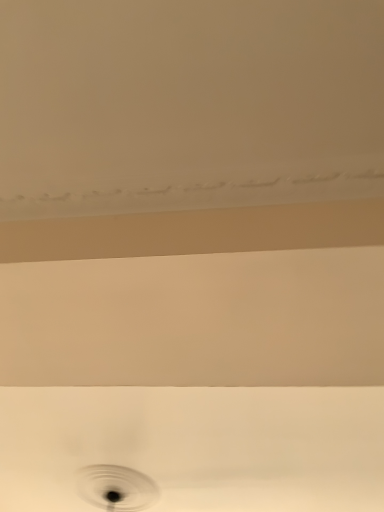
Image resolution: width=384 pixels, height=512 pixels. What do you see at coordinates (197, 446) in the screenshot?
I see `white glossy sink at center` at bounding box center [197, 446].

Locate an element on the screen. The height and width of the screenshot is (512, 384). white glossy sink at center is located at coordinates pyautogui.click(x=197, y=446).

This screenshot has width=384, height=512. I want to click on black matte hole at center, so click(116, 488).

Describe the element at coordinates (116, 488) in the screenshot. I see `black matte hole at center` at that location.

This screenshot has height=512, width=384. In order to click on white glossy sink at center in this screenshot , I will do `click(197, 446)`.

Would you say black matte hole at center is to the left or to the right of white glossy sink at center in the picture?

Clearly, black matte hole at center is on the left of white glossy sink at center in the image.

Relative to white glossy sink at center, is black matte hole at center in front or behind?

black matte hole at center is positioned farther from the viewer than white glossy sink at center.

Which is less distant, (100, 499) or (372, 501)?

Positioned in front is point (372, 501).

From the image's perspective, between black matte hole at center and white glossy sink at center, who is located below?

black matte hole at center, from the image's perspective.

From a real-world perspective, is black matte hole at center beneath white glossy sink at center?

Yes, from a real-world perspective, black matte hole at center is beneath white glossy sink at center.

Considering the relative sizes of black matte hole at center and white glossy sink at center in the image provided, is black matte hole at center wider than white glossy sink at center?

No, black matte hole at center is not wider than white glossy sink at center.

Who is shorter, black matte hole at center or white glossy sink at center?

Standing shorter between the two is white glossy sink at center.

Can you confirm if black matte hole at center is smaller than white glossy sink at center?

Indeed, black matte hole at center has a smaller size compared to white glossy sink at center.

Is black matte hole at center not within white glossy sink at center?

black matte hole at center lies outside white glossy sink at center's area.

Can you see black matte hole at center touching white glossy sink at center?

There is a gap between black matte hole at center and white glossy sink at center.

Consider the image. Is black matte hole at center turned away from white glossy sink at center?

black matte hole at center is not turned away from white glossy sink at center.

I want to click on plumbing fixture in front of the black matte hole at center, so click(197, 446).

Which is more to the right, white glossy sink at center or black matte hole at center?

white glossy sink at center is more to the right.

Considering their positions, is white glossy sink at center located in front of or behind black matte hole at center?

Visually, white glossy sink at center is located in front of black matte hole at center.

Does point (240, 434) come in front of point (122, 492)?

Yes, it is.

From the image's perspective, is white glossy sink at center over black matte hole at center?

Yes, from the image's perspective, white glossy sink at center is above black matte hole at center.

From a real-world perspective, is white glossy sink at center physically located above or below black matte hole at center?

white glossy sink at center is situated higher than black matte hole at center in the real world.

Between white glossy sink at center and black matte hole at center, which one has larger width?

white glossy sink at center.

Considering the sizes of objects white glossy sink at center and black matte hole at center in the image provided, who is shorter, white glossy sink at center or black matte hole at center?

Standing shorter between the two is white glossy sink at center.

Which of these two, white glossy sink at center or black matte hole at center, is bigger?

Bigger between the two is white glossy sink at center.

Could black matte hole at center be considered to be inside white glossy sink at center?

No, black matte hole at center is not inside white glossy sink at center.

Is white glossy sink at center far away from black matte hole at center?

No, white glossy sink at center is in close proximity to black matte hole at center.

Could you tell me if white glossy sink at center is turned towards black matte hole at center?

No, white glossy sink at center does not turn towards black matte hole at center.

How many degrees apart are the facing directions of white glossy sink at center and black matte hole at center?

The angle between the facing direction of white glossy sink at center and the facing direction of black matte hole at center is 0.0423 degrees.

Locate an element on the screen. hole located below the white glossy sink at center (from the image's perspective) is located at coordinates [x=116, y=488].

Find the location of a particular element. The image size is (384, 512). plumbing fixture in front of the black matte hole at center is located at coordinates (197, 446).

Locate an element on the screen. This screenshot has height=512, width=384. plumbing fixture that is on the right side of black matte hole at center is located at coordinates (197, 446).